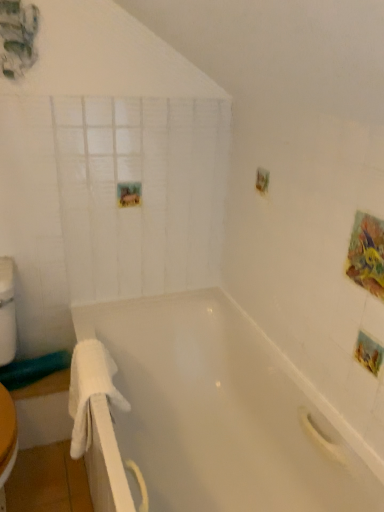
Find the location of `vacant space situated above white matte glass door at upper left (from a real-world perspective)`. vacant space situated above white matte glass door at upper left (from a real-world perspective) is located at coordinates [x=118, y=90].